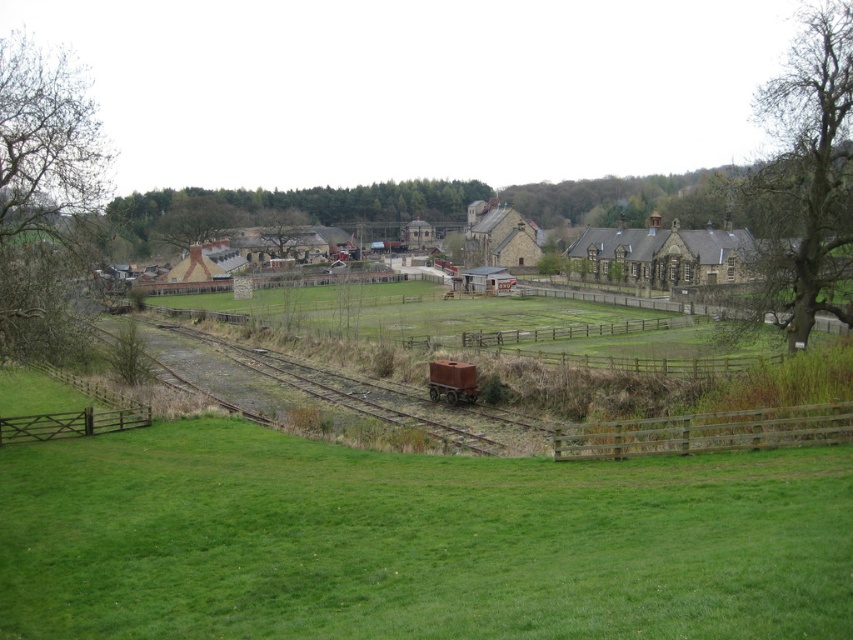
Based on the photo, you are a gardener who needs to place a new 7.5 meter long fence between the bare branches at left and the brown wooden fence at lower left. Will the existing space between them be sufficient?

The distance between the bare branches at left and the brown wooden fence at lower left is 6.85 meters. Since the new fence is 7.5 meters long, it will not fit in the available space.

You are standing at the lower left corner of the image and want to see the green leafy tree at center. Is the brown wooden fence at lower left blocking your view of the tree?

The green leafy tree at center is much taller than the brown wooden fence at lower left, so the fence will not block your view of the tree.